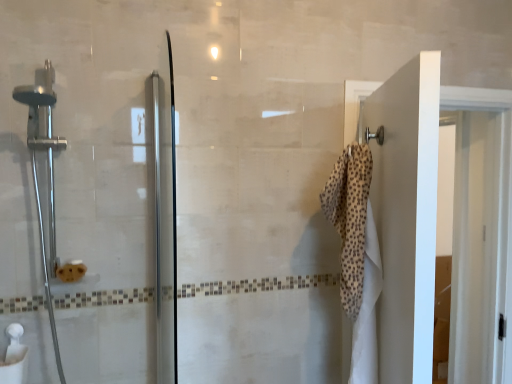
Question: Is beige dotted towel at right wider or thinner than satin chrome shower head at left?

Choices:
 (A) wide
 (B) thin

Answer: (B)

Question: From the image's perspective, is beige dotted towel at right above or below satin chrome shower head at left?

Choices:
 (A) above
 (B) below

Answer: (B)

Question: Based on their sizes in the image, would you say beige dotted towel at right is bigger or smaller than satin chrome shower head at left?

Choices:
 (A) small
 (B) big

Answer: (A)

Question: Is point (41, 99) positioned closer to the camera than point (349, 144)?

Choices:
 (A) farther
 (B) closer

Answer: (B)

Question: From a real-world perspective, is satin chrome shower head at left above or below beige dotted towel at right?

Choices:
 (A) above
 (B) below

Answer: (A)

Question: Is satin chrome shower head at left taller or shorter than beige dotted towel at right?

Choices:
 (A) short
 (B) tall

Answer: (B)

Question: In terms of width, does satin chrome shower head at left look wider or thinner when compared to beige dotted towel at right?

Choices:
 (A) thin
 (B) wide

Answer: (B)